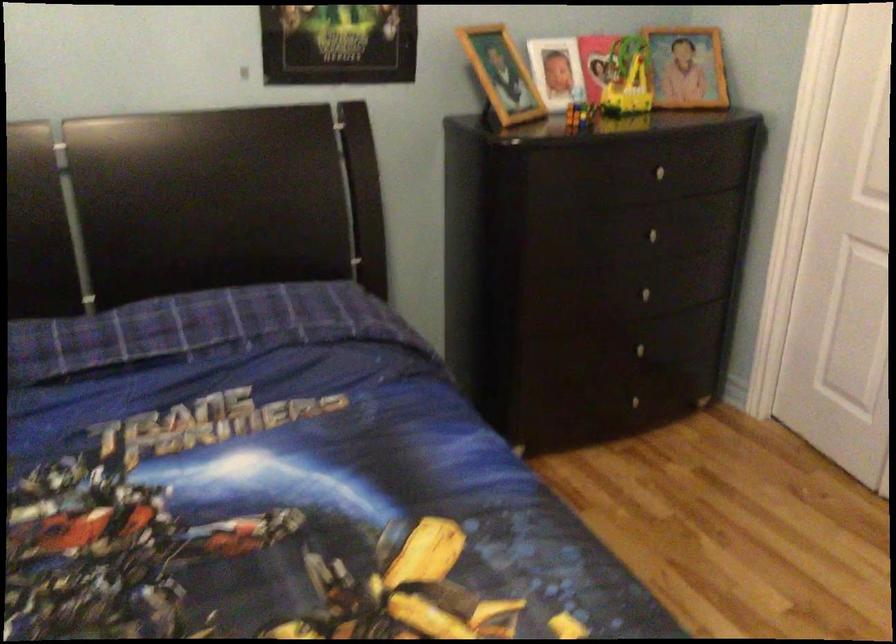
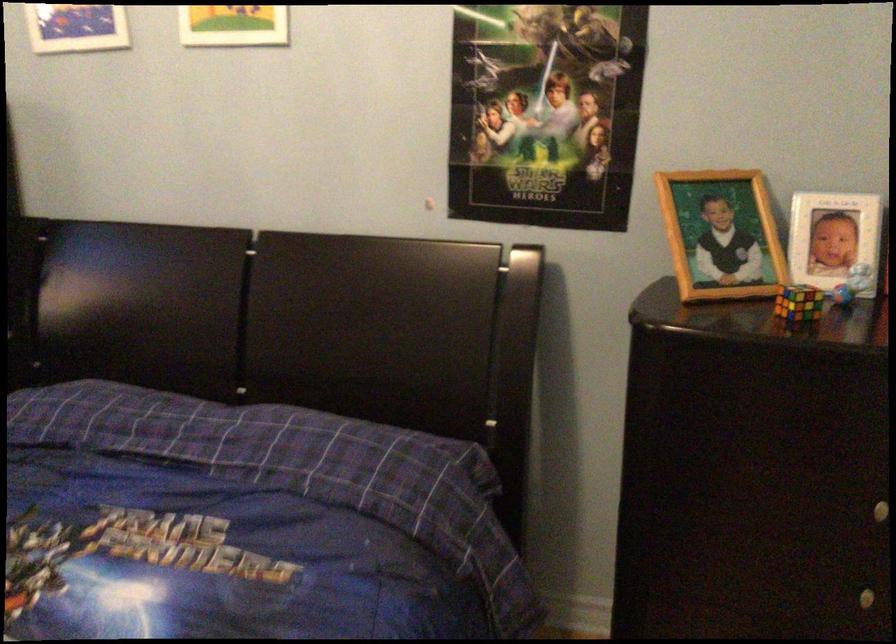
In the second image, find the point that corresponds to [582,108] in the first image.

(798, 303)